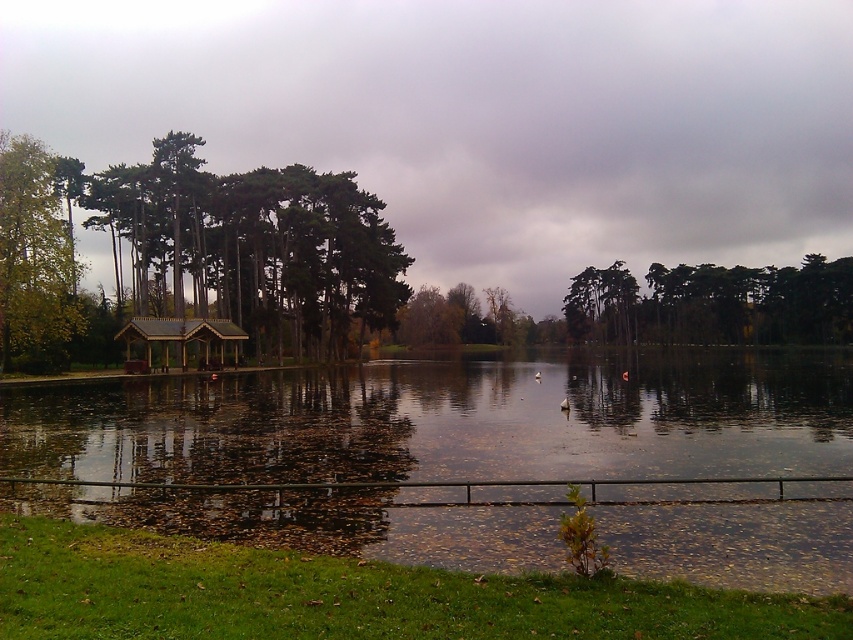
Does green matte gazebo at left have a greater width compared to green matte trees at center?

Incorrect, green matte gazebo at left's width does not surpass green matte trees at center's.

Locate an element on the screen. green matte gazebo at left is located at coordinates (194, 250).

Can you confirm if green matte trees at center is positioned above wooden gazebo at center?

Indeed, green matte trees at center is positioned over wooden gazebo at center.

Which of these two, green matte trees at center or wooden gazebo at center, stands shorter?

wooden gazebo at center is shorter.

Which is behind, point (741, 316) or point (149, 346)?

Positioned behind is point (741, 316).

Find the location of a particular element. The width and height of the screenshot is (853, 640). green matte trees at center is located at coordinates (714, 304).

Is reflective water at center smaller than green matte gazebo at left?

Indeed, reflective water at center has a smaller size compared to green matte gazebo at left.

The height and width of the screenshot is (640, 853). What do you see at coordinates (473, 458) in the screenshot?
I see `reflective water at center` at bounding box center [473, 458].

The width and height of the screenshot is (853, 640). I want to click on reflective water at center, so click(x=473, y=458).